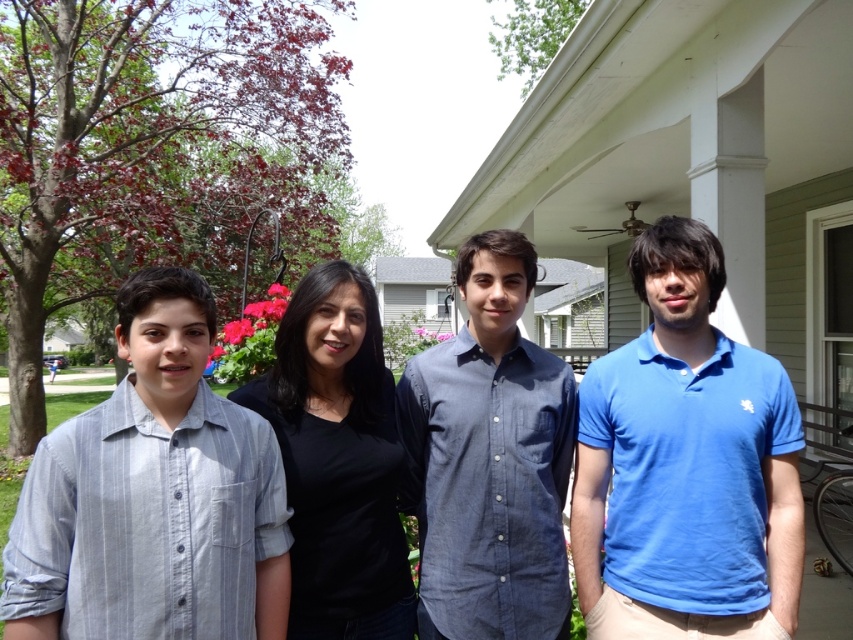
Question: Which of the following is the farthest from the observer?

Choices:
 (A) blue cotton polo shirt at center
 (B) light blue striped shirt at left
 (C) black matte shirt at center

Answer: (A)

Question: Is blue denim shirt at center below black matte shirt at center?

Choices:
 (A) no
 (B) yes

Answer: (A)

Question: Among these objects, which one is nearest to the camera?

Choices:
 (A) light blue striped shirt at center
 (B) black matte shirt at center
 (C) blue cotton polo shirt at center

Answer: (B)

Question: Is light blue striped shirt at left above black matte shirt at center?

Choices:
 (A) yes
 (B) no

Answer: (A)

Question: Which point is farther to the camera?

Choices:
 (A) (79, 481)
 (B) (413, 376)

Answer: (B)

Question: Is blue denim shirt at center to the left of black matte shirt at center from the viewer's perspective?

Choices:
 (A) yes
 (B) no

Answer: (B)